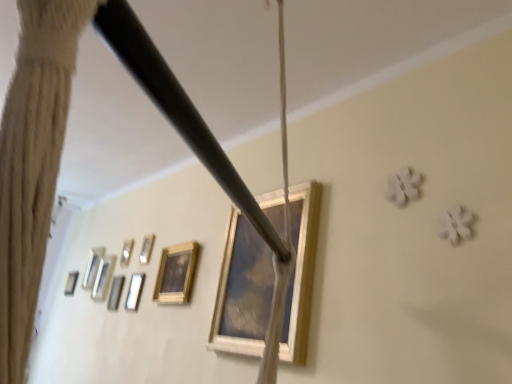
Question: Does metallic silver picture frame at upper left, which appears as the fifth picture frame when viewed from the back, have a greater height compared to wooden picture frame at lower left, which is counted as the 6th picture frame, starting from the left?

Choices:
 (A) no
 (B) yes

Answer: (A)

Question: Is wooden picture frame at lower left, which is counted as the 6th picture frame, starting from the left, surrounded by metallic silver picture frame at upper left, which is counted as the third picture frame, starting from the front?

Choices:
 (A) no
 (B) yes

Answer: (A)

Question: Is metallic silver picture frame at upper left, marked as the 4th picture frame in a left-to-right arrangement, shorter than wooden picture frame at lower left, which is the second picture frame in right-to-left order?

Choices:
 (A) no
 (B) yes

Answer: (B)

Question: Is metallic silver picture frame at upper left, the fourth picture frame from the right, behind wooden picture frame at lower left, which is counted as the 6th picture frame, starting from the left?

Choices:
 (A) yes
 (B) no

Answer: (A)

Question: From the image's perspective, does metallic silver picture frame at upper left, the fourth picture frame from the right, appear higher than wooden picture frame at lower left, which is counted as the 6th picture frame, starting from the left?

Choices:
 (A) no
 (B) yes

Answer: (A)

Question: Is metallic silver picture frame at upper left, which is counted as the third picture frame, starting from the front, oriented away from wooden picture frame at lower left, which is counted as the 6th picture frame, starting from the left?

Choices:
 (A) yes
 (B) no

Answer: (B)

Question: Is wooden picture frame at left, acting as the fifth picture frame starting from the right, not near metallic silver picture frame at upper left, marked as the 4th picture frame in a left-to-right arrangement?

Choices:
 (A) yes
 (B) no

Answer: (B)

Question: Could you tell me if wooden picture frame at left, which is the third picture frame in left-to-right order, is turned towards metallic silver picture frame at upper left, marked as the 4th picture frame in a left-to-right arrangement?

Choices:
 (A) yes
 (B) no

Answer: (B)

Question: Considering the relative sizes of wooden picture frame at left, which is counted as the fifth picture frame, starting from the front, and metallic silver picture frame at upper left, marked as the 4th picture frame in a left-to-right arrangement, in the image provided, is wooden picture frame at left, which is counted as the fifth picture frame, starting from the front, bigger than metallic silver picture frame at upper left, marked as the 4th picture frame in a left-to-right arrangement,?

Choices:
 (A) yes
 (B) no

Answer: (A)

Question: From a real-world perspective, is wooden picture frame at left, acting as the fifth picture frame starting from the right, positioned under metallic silver picture frame at upper left, marked as the 4th picture frame in a left-to-right arrangement, based on gravity?

Choices:
 (A) yes
 (B) no

Answer: (B)

Question: Can metallic silver picture frame at upper left, which appears as the fifth picture frame when viewed from the back, be found inside wooden picture frame at left, which is counted as the fifth picture frame, starting from the front?

Choices:
 (A) yes
 (B) no

Answer: (B)

Question: Is wooden picture frame at left, which is the third picture frame in left-to-right order, to the left of metallic silver picture frame at upper left, the fourth picture frame from the right, from the viewer's perspective?

Choices:
 (A) no
 (B) yes

Answer: (B)

Question: Considering the relative sizes of metallic silver picture frame at upper left, which is counted as the 6th picture frame, starting from the front, and metallic silver picture frame at upper left, marked as the 4th picture frame in a left-to-right arrangement, in the image provided, is metallic silver picture frame at upper left, which is counted as the 6th picture frame, starting from the front, thinner than metallic silver picture frame at upper left, marked as the 4th picture frame in a left-to-right arrangement,?

Choices:
 (A) yes
 (B) no

Answer: (B)